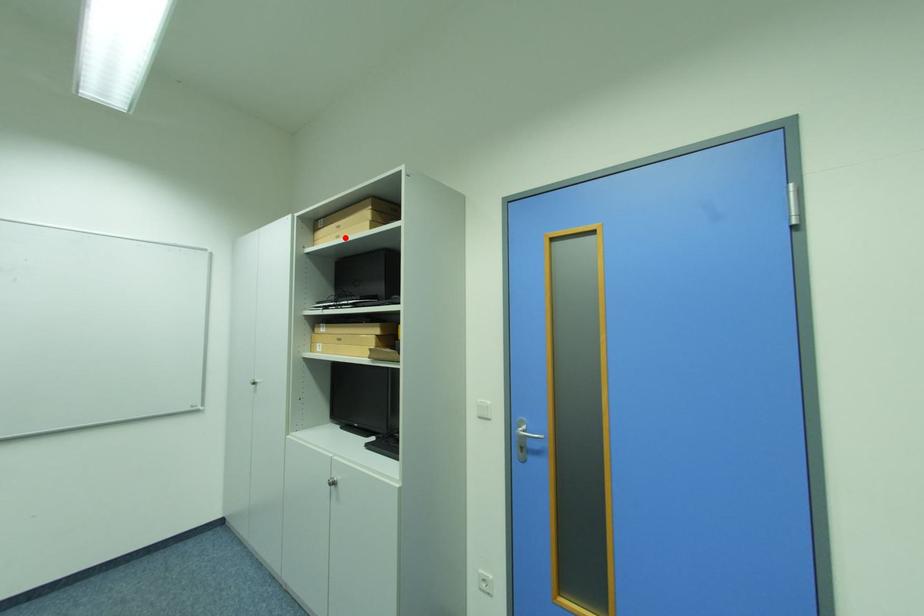
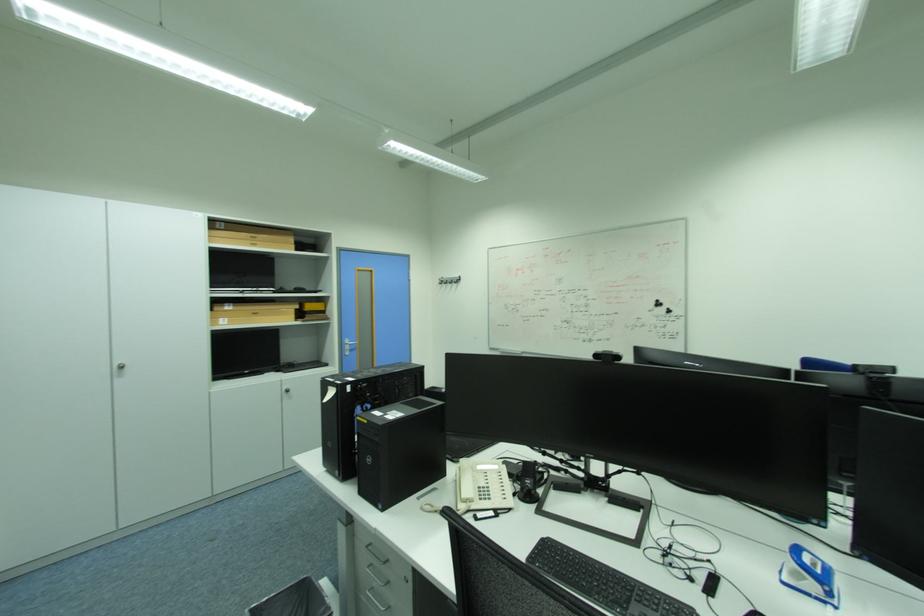
Locate, in the second image, the point that corresponds to the highlighted location in the first image.

(261, 246)